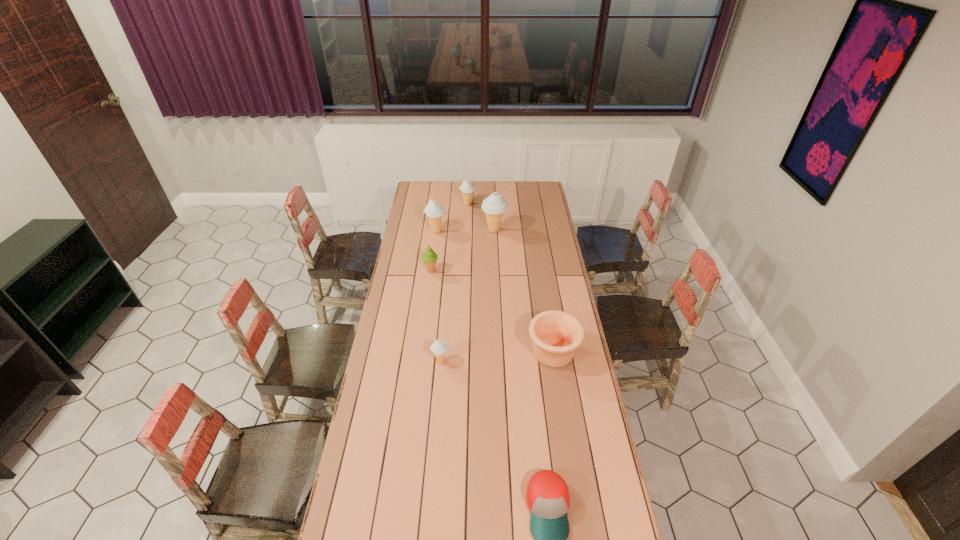
The width and height of the screenshot is (960, 540). In the image, there is a desktop. In order to click on free space at the right edge in this screenshot , I will do pos(586,414).

You are a GUI agent. You are given a task and a screenshot of the screen. Output one action in this format:
    pyautogui.click(x=<x>, y=<y>)
    Task: Click on the vacant area that lies between the fourth shortest icecream and the farthest object
    
    Given the screenshot: What is the action you would take?
    pyautogui.click(x=451, y=218)

Locate an element on the screen. The height and width of the screenshot is (540, 960). vacant space that is in between the pottery and the farthest icecream is located at coordinates (510, 279).

Where is `empty space that is in between the third smallest beige icecream and the rightmost icecream`? This screenshot has height=540, width=960. empty space that is in between the third smallest beige icecream and the rightmost icecream is located at coordinates (465, 231).

Select which object is the closest to the pottery. Please provide its 2D coordinates. Your answer should be formatted as a tuple, i.e. [(x, y)], where the tuple contains the x and y coordinates of a point satisfying the conditions above.

[(439, 348)]

Locate which object ranks sixth in proximity to the smallest beige icecream. Please provide its 2D coordinates. Your answer should be formatted as a tuple, i.e. [(x, y)], where the tuple contains the x and y coordinates of a point satisfying the conditions above.

[(466, 188)]

I want to click on icecream that is the nearest to the fourth farthest object, so click(434, 211).

This screenshot has width=960, height=540. Find the location of `the fourth closest icecream to the pottery`. the fourth closest icecream to the pottery is located at coordinates (434, 211).

Identify which beige icecream is the nearest to the nearest beige icecream. Please provide its 2D coordinates. Your answer should be formatted as a tuple, i.e. [(x, y)], where the tuple contains the x and y coordinates of a point satisfying the conditions above.

[(434, 211)]

Find the location of a particular element. beige icecream that can be found as the closest to the sixth shortest object is located at coordinates [x=466, y=188].